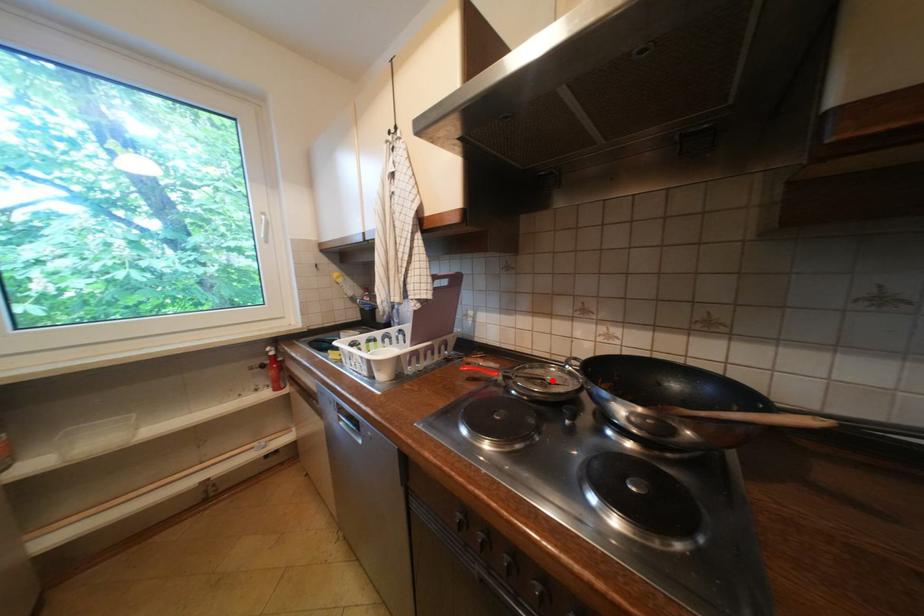
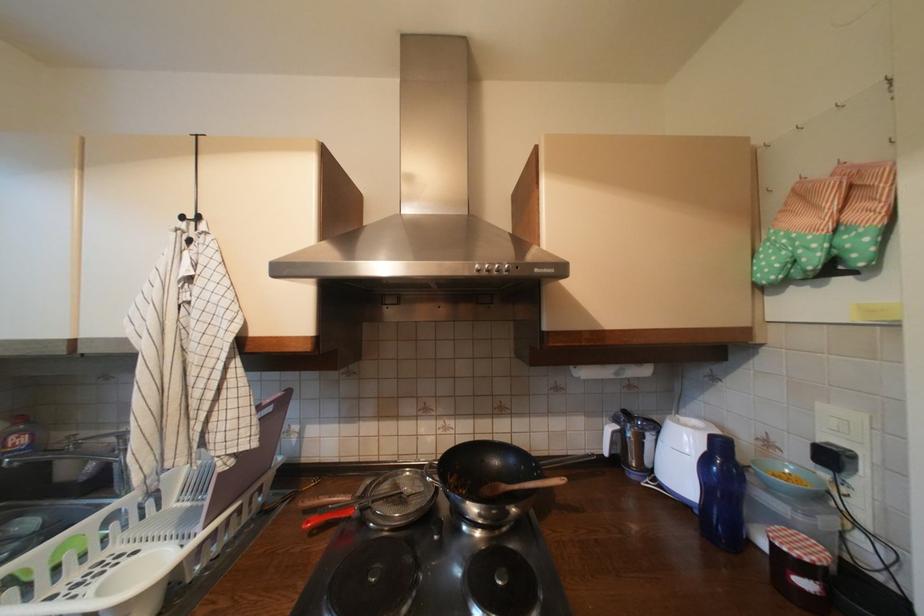
The point at the highlighted location is marked in the first image. Where is the corresponding point in the second image?

(410, 495)